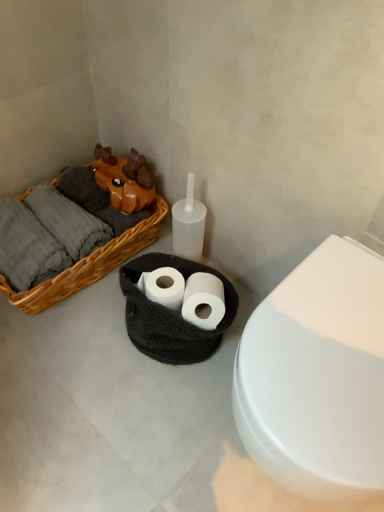
Identify the location of free space in front of black crocheted basket at center. The width and height of the screenshot is (384, 512). (155, 410).